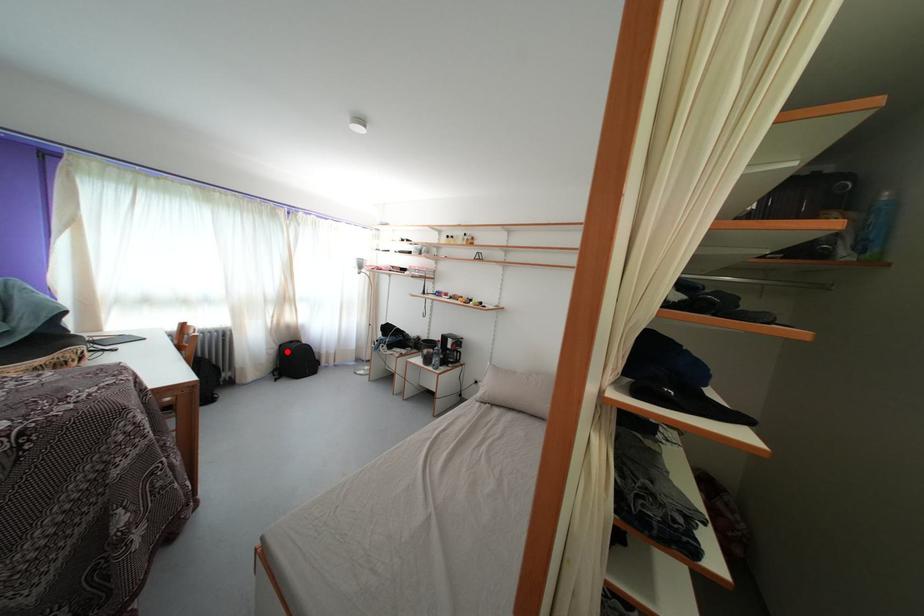
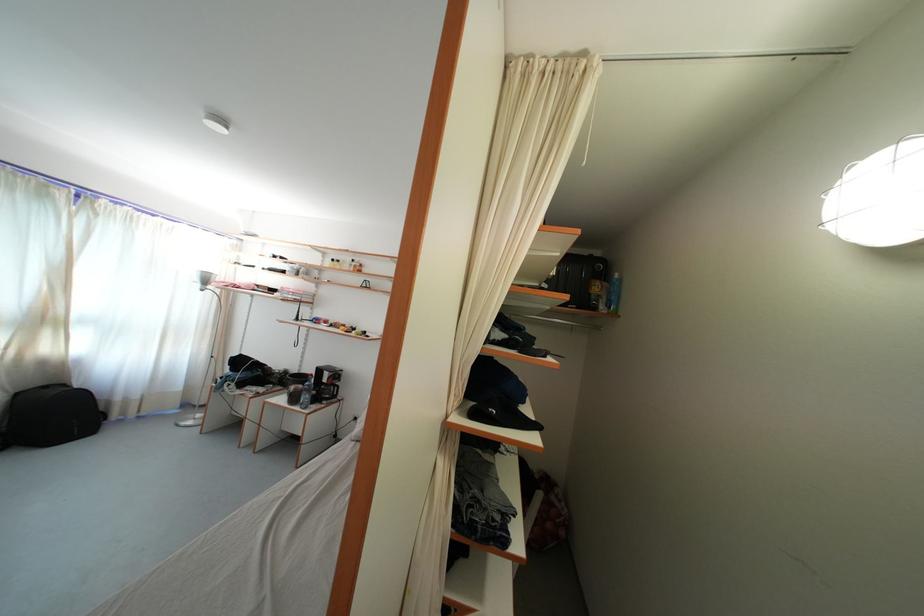
Question: A red point is marked in image1. In image2, is the corresponding 3D point closer to the camera or farther? Reply with the corresponding letter.

Choices:
 (A) The corresponding 3D point is closer.
 (B) The corresponding 3D point is farther.

Answer: (B)